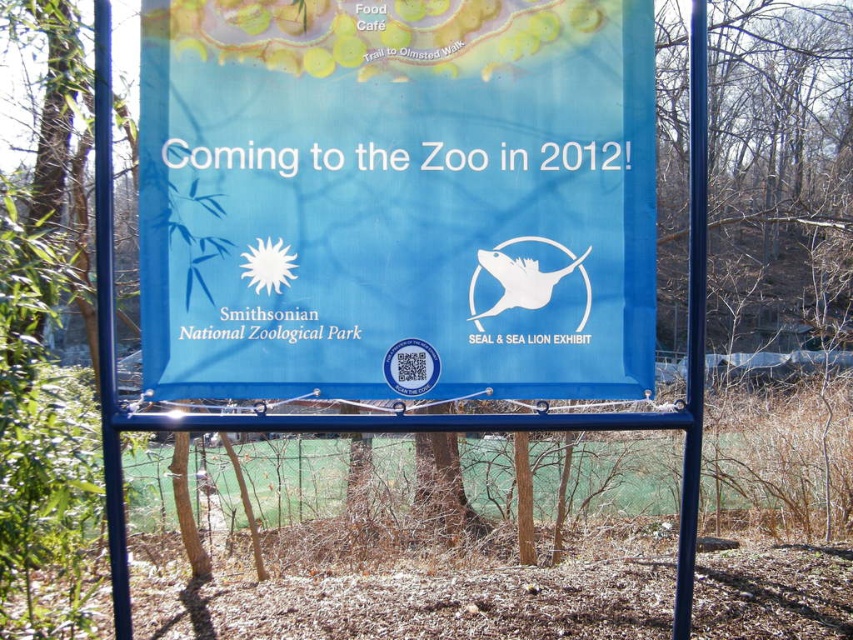
You are standing at the origin point in a coordinate system where the bottom left corner of the image is the origin. The blue fabric sign at center is located at coordinates approximately where? Please provide the coordinates as a point in the format of a tuple, like this example format for a point at 0.3,0.465 would be written as point at 0.3,0.465. The question must include the exact object labels from the Objects section. The answer must use the Objects Description to state the coordinates. The question,

The blue fabric sign at center is located at point (396, 196).

You are standing in front of the blue metallic pole at left and the blue fabric sign at center. Which object is taller?

The blue metallic pole at left is taller than the blue fabric sign at center.